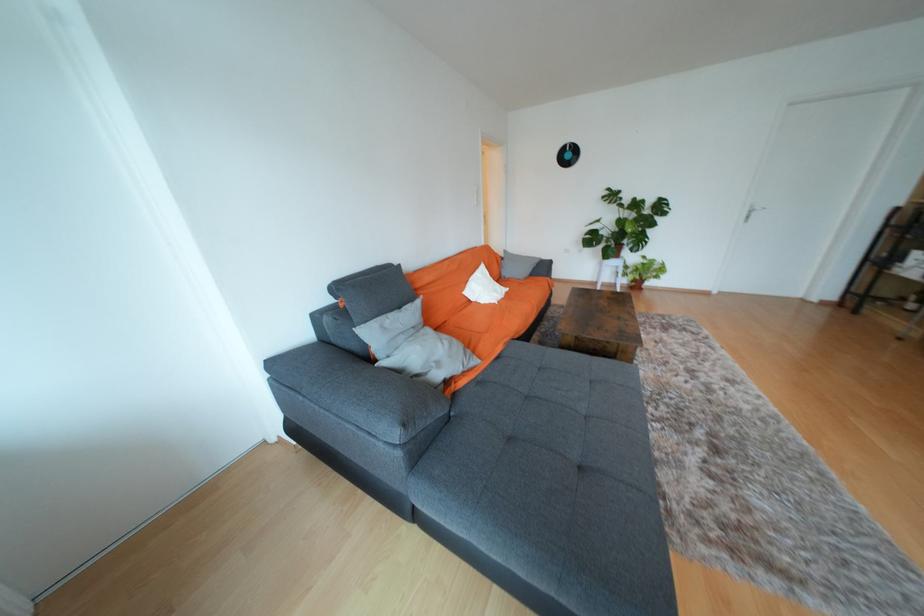
Find the location of a particular element. sofa armrest is located at coordinates (359, 391).